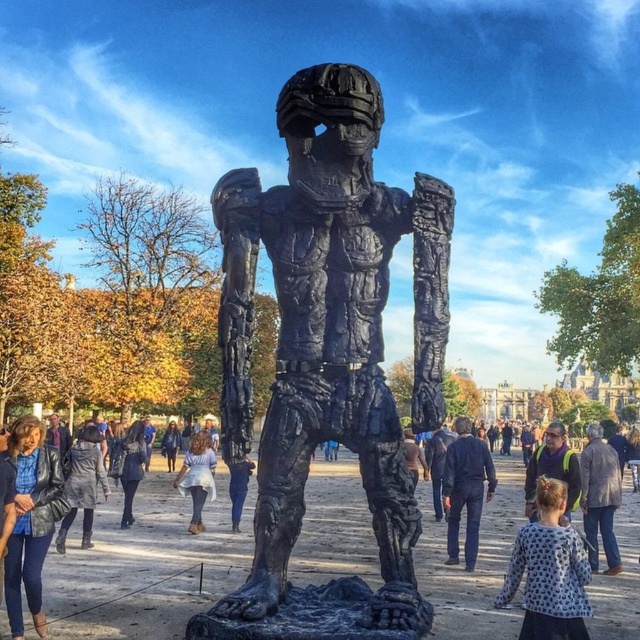
Question: Estimate the real-world distances between objects in this image. Which object is farther from the leather jacket at lower left?

Choices:
 (A) light blue denim skirt at center
 (B) dark blue leather jacket at center
 (C) black matte sculpture at center

Answer: (B)

Question: Does light blue denim skirt at center come in front of dark blue leather jacket at center?

Choices:
 (A) yes
 (B) no

Answer: (A)

Question: Which object is positioned farthest from the dark blue jeans at center?

Choices:
 (A) dark brown leather jacket at lower right
 (B) leather jacket at lower left
 (C) dark blue leather jacket at center

Answer: (B)

Question: Among these objects, which one is nearest to the camera?

Choices:
 (A) dark blue jeans at center
 (B) dark brown leather jacket at lower right

Answer: (B)

Question: Can you confirm if black matte sculpture at center is positioned to the left of dark blue leather jacket at center?

Choices:
 (A) no
 (B) yes

Answer: (A)

Question: Can you confirm if light blue denim skirt at center is smaller than denim jacket at center?

Choices:
 (A) yes
 (B) no

Answer: (B)